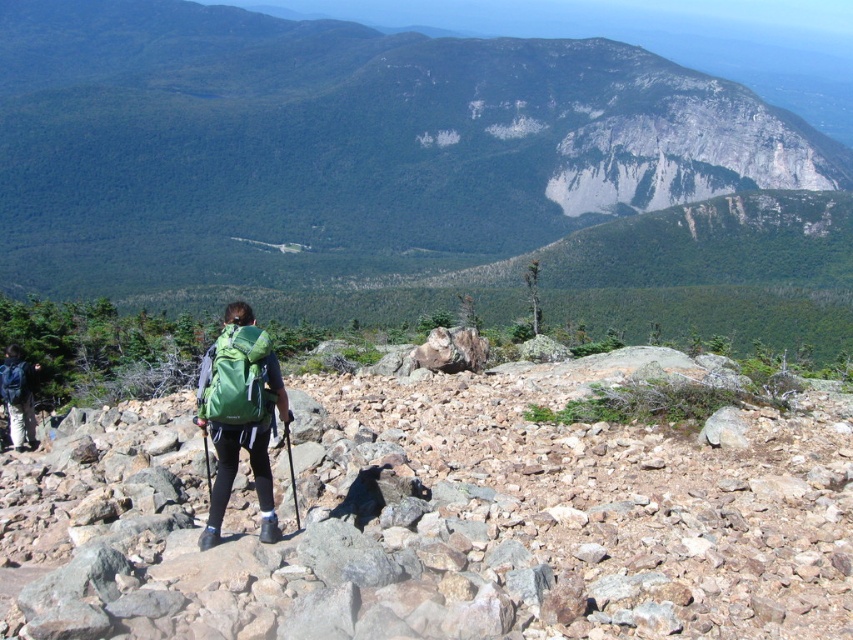
You are a hiker trying to place your gear safely. You have a green rock at center and a dark blue backpack at lower left. Which object is positioned to the left?

The green rock at center is to the left of the dark blue backpack at lower left.

You are a hiker who wants to place a small rock into your backpack. You see the green rock at center and the green fabric backpack at center. Which object is located to the left of the other?

The green rock at center is to the left of the green fabric backpack at center.